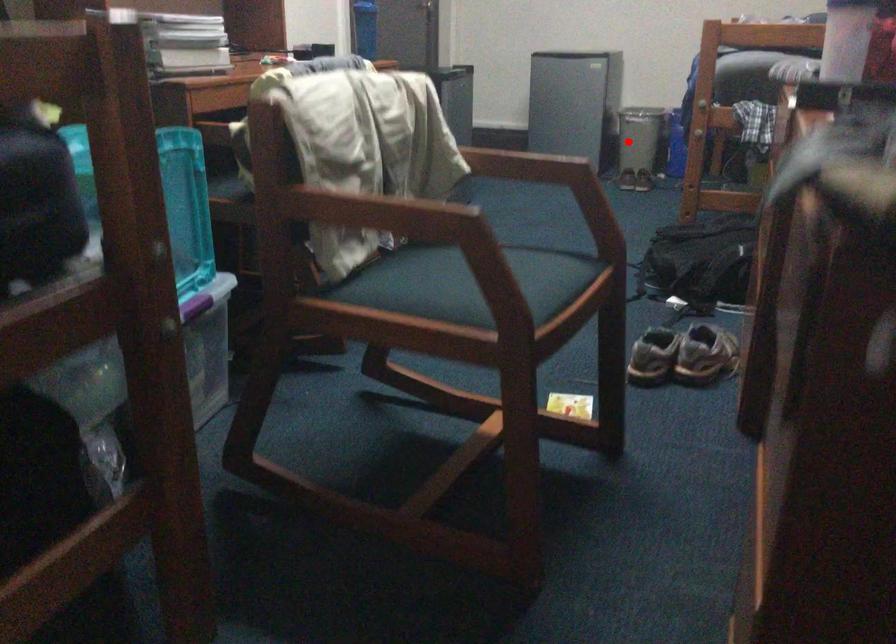
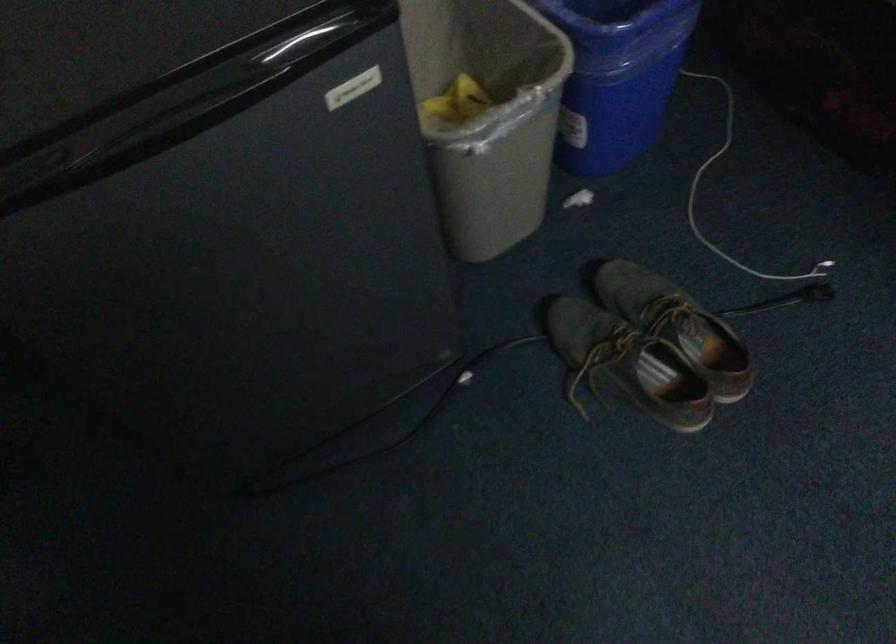
Find the pixel in the second image that matches the highlighted location in the first image.

(662, 323)